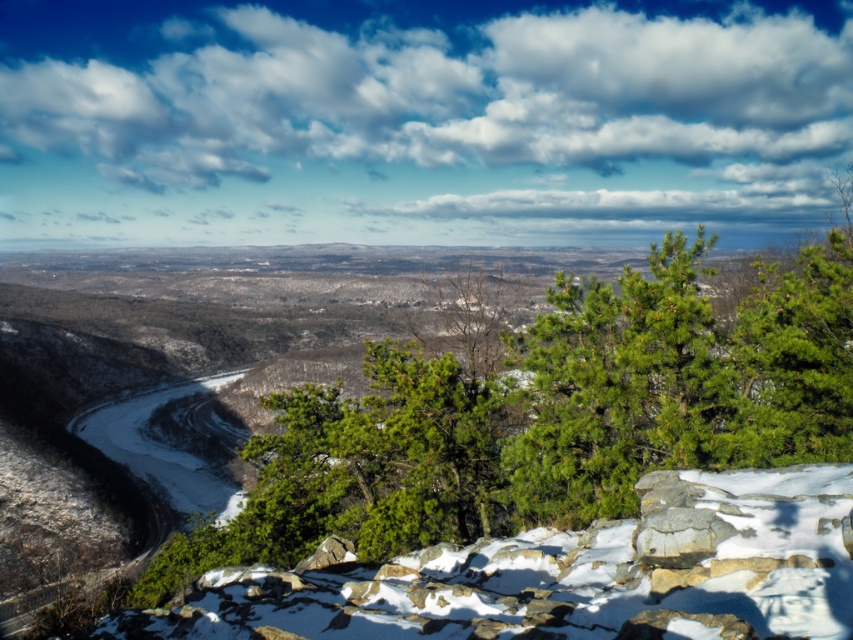
Which is in front, point (677, 374) or point (793, 552)?

Point (793, 552)

Which is more to the right, green needle-like at center or white powdery snow at center?

white powdery snow at center is more to the right.

Which is behind, point (305, 484) or point (453, 584)?

Point (305, 484)

What are the coordinates of `green needle-like at center` in the screenshot? It's located at (549, 416).